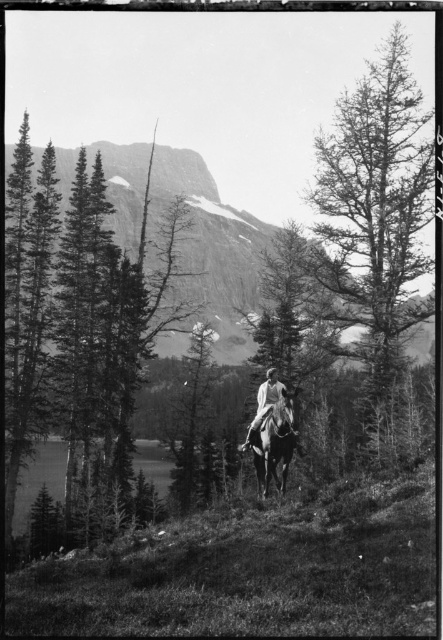
Question: Which point is farther to the camera?

Choices:
 (A) [x=209, y=308]
 (B) [x=287, y=442]

Answer: (A)

Question: Is smooth bark tree at center wider than white clothed figure at center?

Choices:
 (A) yes
 (B) no

Answer: (A)

Question: Where is white glossy horse at center located in relation to white clothed figure at center in the image?

Choices:
 (A) right
 (B) left

Answer: (B)

Question: Which of the following is the farthest from the observer?

Choices:
 (A) (272, 380)
 (B) (267, 227)

Answer: (B)

Question: Which of the following is the closest to the observer?

Choices:
 (A) (261, 406)
 (B) (349, 294)

Answer: (A)

Question: Is rugged stone mountain at upper center positioned behind white clothed figure at center?

Choices:
 (A) yes
 (B) no

Answer: (A)